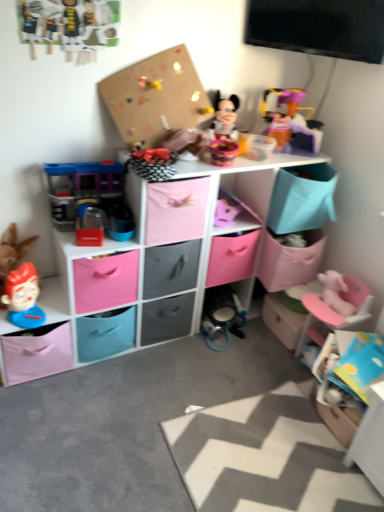
Locate an element on the screen. vacant area that lies between pink plastic swivel chair at lower right and pink fabric storage box at left, which ranks as the 3th storage box in right-to-left order is located at coordinates (193, 371).